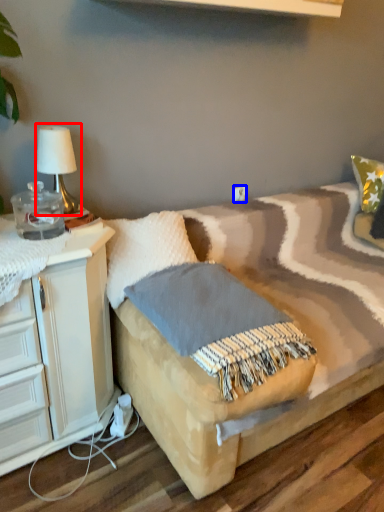
Question: Among these objects, which one is farthest to the camera, table lamp (highlighted by a red box) or electric outlet (highlighted by a blue box)?

Choices:
 (A) table lamp
 (B) electric outlet

Answer: (B)